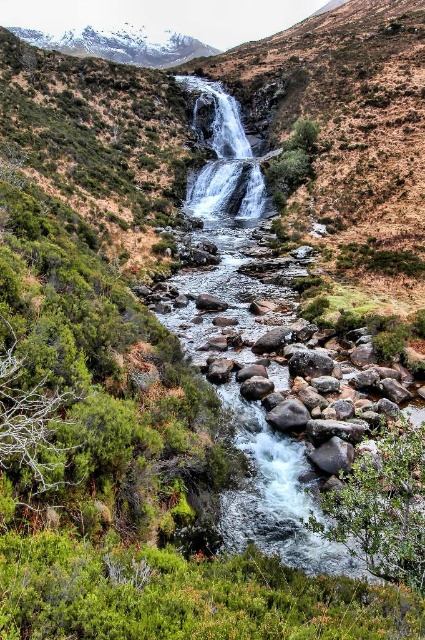
Which of these two, white smooth water at center or snowy granite mountain at upper left, stands shorter?

white smooth water at center

Does point (243, 192) lie behind point (73, 51)?

No, (243, 192) is closer to viewer.

The width and height of the screenshot is (425, 640). In order to click on white smooth water at center in this screenshot , I will do `click(227, 211)`.